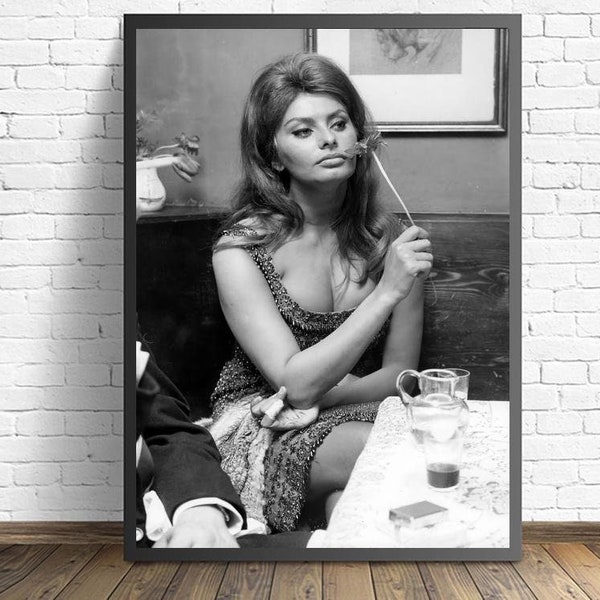
At what (x,y) coordinates should I click in order to perform the action: click on white cement brick wall. Please return your answer as a coordinate pair (x, y). This screenshot has height=600, width=600. Looking at the image, I should click on (39, 314).